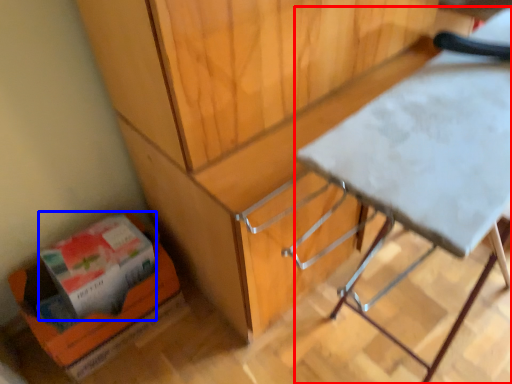
Question: Among these objects, which one is farthest to the camera, table (highlighted by a red box) or box (highlighted by a blue box)?

Choices:
 (A) table
 (B) box

Answer: (B)